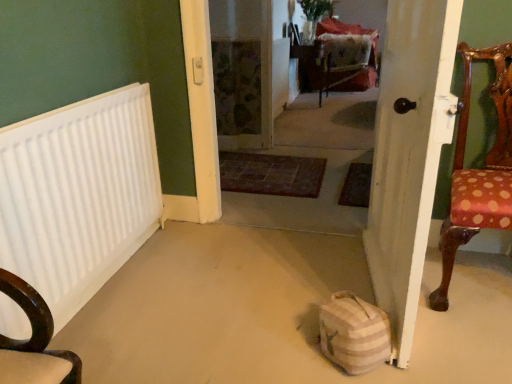
Question: Is velvet red armchair at center next to striped fabric bag at lower center?

Choices:
 (A) no
 (B) yes

Answer: (A)

Question: From the image's perspective, is velvet red armchair at center over striped fabric bag at lower center?

Choices:
 (A) yes
 (B) no

Answer: (A)

Question: Considering the relative sizes of velvet red armchair at center and striped fabric bag at lower center in the image provided, is velvet red armchair at center smaller than striped fabric bag at lower center?

Choices:
 (A) yes
 (B) no

Answer: (B)

Question: Can you confirm if velvet red armchair at center is wider than striped fabric bag at lower center?

Choices:
 (A) yes
 (B) no

Answer: (A)

Question: Could striped fabric bag at lower center be considered to be inside velvet red armchair at center?

Choices:
 (A) yes
 (B) no

Answer: (B)

Question: Considering their positions, is carpeted floor at center located in front of or behind velvet red armchair at center?

Choices:
 (A) behind
 (B) front

Answer: (B)

Question: Is point pyautogui.click(x=344, y=6) positioned closer to the camera than point pyautogui.click(x=333, y=79)?

Choices:
 (A) farther
 (B) closer

Answer: (A)

Question: From the image's perspective, is carpeted floor at center located above or below velvet red armchair at center?

Choices:
 (A) above
 (B) below

Answer: (B)

Question: Is carpeted floor at center inside or outside of velvet red armchair at center?

Choices:
 (A) inside
 (B) outside

Answer: (B)

Question: From the image's perspective, is striped fabric bag at lower center positioned above or below carpeted floor at center?

Choices:
 (A) below
 (B) above

Answer: (A)

Question: Considering their positions, is striped fabric bag at lower center located in front of or behind carpeted floor at center?

Choices:
 (A) front
 (B) behind

Answer: (A)

Question: From their relative heights in the image, would you say striped fabric bag at lower center is taller or shorter than carpeted floor at center?

Choices:
 (A) short
 (B) tall

Answer: (A)

Question: Is striped fabric bag at lower center wider or thinner than carpeted floor at center?

Choices:
 (A) thin
 (B) wide

Answer: (B)

Question: Relative to striped fabric bag at lower center, is velvet red armchair at center in front or behind?

Choices:
 (A) behind
 (B) front

Answer: (A)

Question: Is point (338, 82) closer or farther from the camera than point (351, 327)?

Choices:
 (A) closer
 (B) farther

Answer: (B)